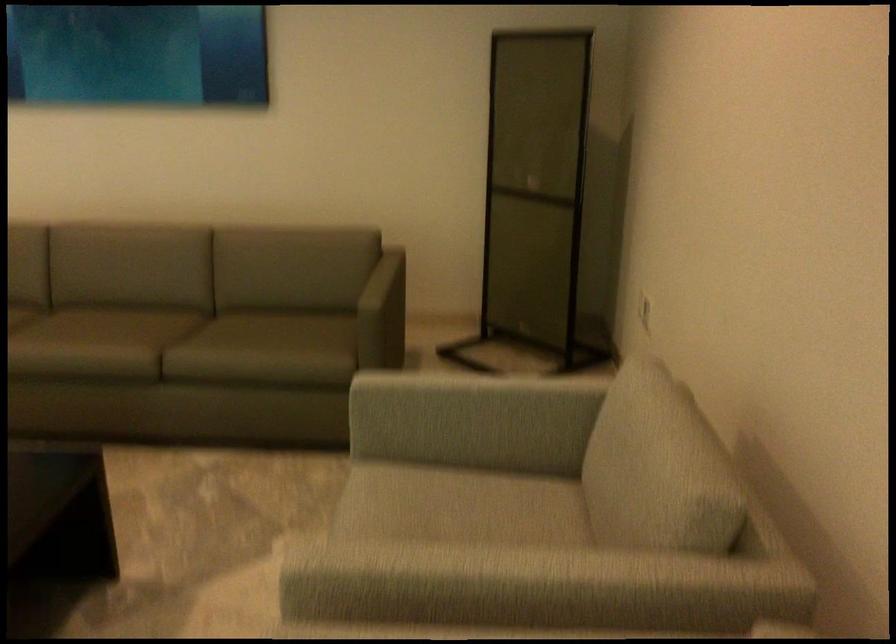
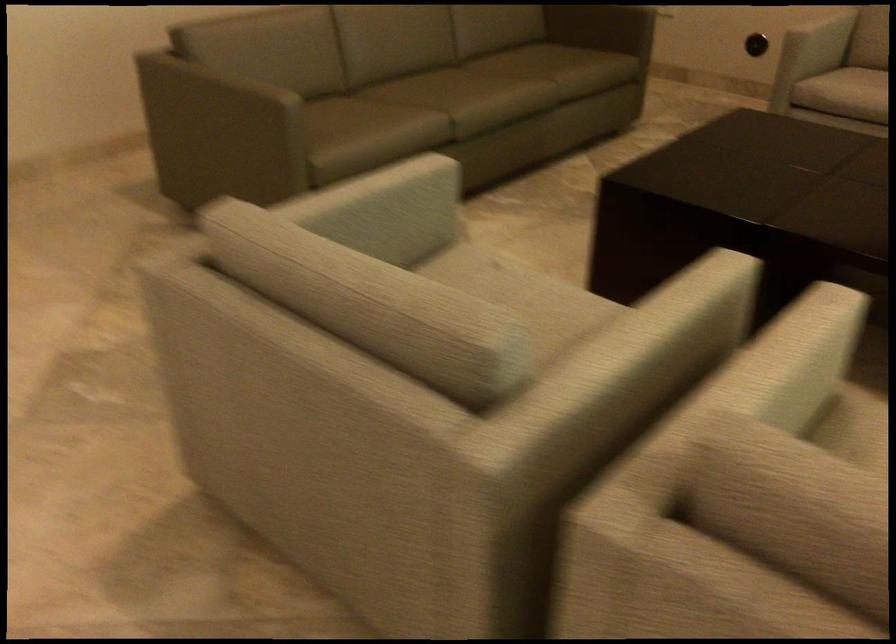
In the second image, find the point that corresponds to point 487,422 in the first image.

(821, 35)